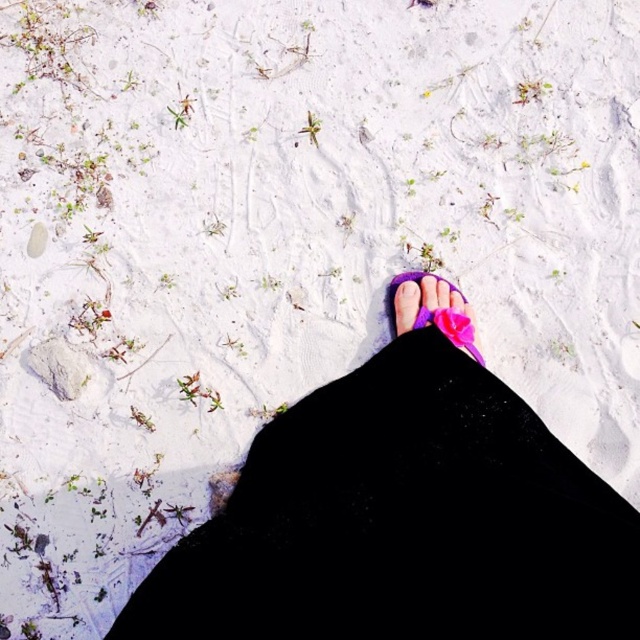
Does point (413, 518) come in front of point (468, 337)?

Yes, it is in front of point (468, 337).

Between purple fabric pants at center and purple fabric sandal at center, which one is positioned lower?

purple fabric pants at center is lower down.

Is point (477, 573) positioned in front of point (419, 298)?

Yes, point (477, 573) is in front of point (419, 298).

Find the location of a particular element. The width and height of the screenshot is (640, 640). purple fabric pants at center is located at coordinates (403, 516).